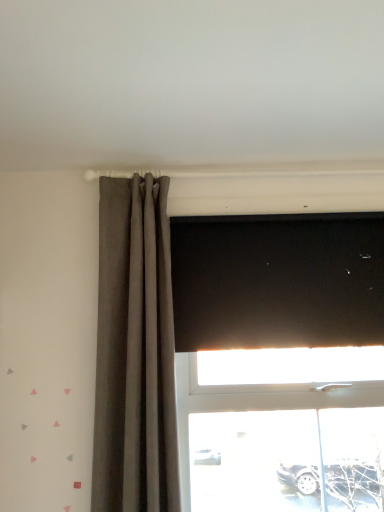
Question: In terms of height, does black matte blind at upper center look taller or shorter compared to matte gray curtain at left?

Choices:
 (A) short
 (B) tall

Answer: (A)

Question: From the image's perspective, is black matte blind at upper center positioned above or below matte gray curtain at left?

Choices:
 (A) above
 (B) below

Answer: (A)

Question: From a real-world perspective, is black matte blind at upper center above or below matte gray curtain at left?

Choices:
 (A) below
 (B) above

Answer: (B)

Question: In terms of height, does matte gray curtain at left look taller or shorter compared to black matte blind at upper center?

Choices:
 (A) short
 (B) tall

Answer: (B)

Question: In terms of width, does matte gray curtain at left look wider or thinner when compared to black matte blind at upper center?

Choices:
 (A) wide
 (B) thin

Answer: (A)

Question: From the image's perspective, is matte gray curtain at left above or below black matte blind at upper center?

Choices:
 (A) above
 (B) below

Answer: (B)

Question: Looking at the image, does matte gray curtain at left seem bigger or smaller compared to black matte blind at upper center?

Choices:
 (A) small
 (B) big

Answer: (B)